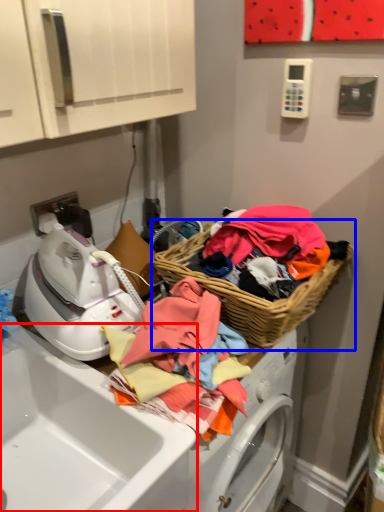
Question: Which point is further to the camera, sink (highlighted by a red box) or picnic basket (highlighted by a blue box)?

Choices:
 (A) sink
 (B) picnic basket

Answer: (B)